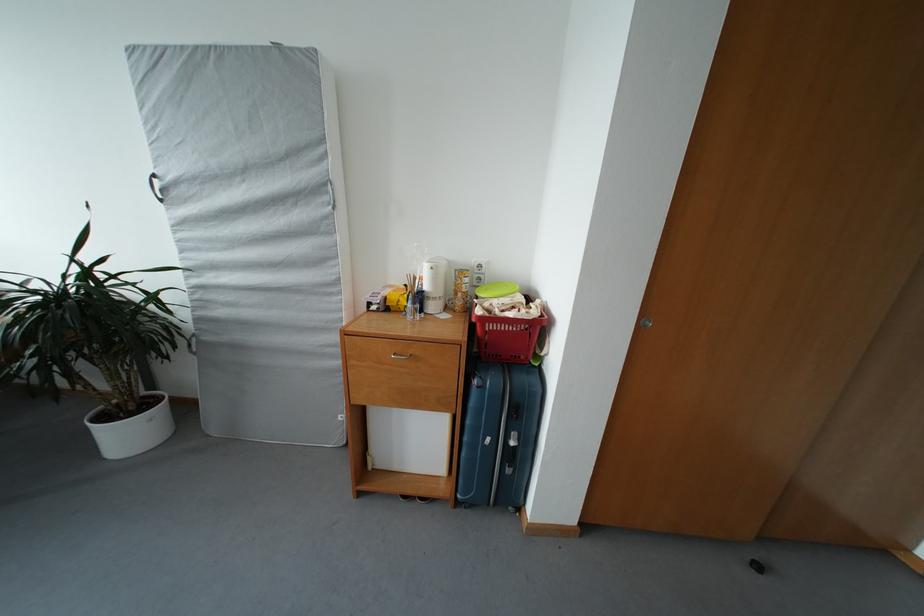
I want to click on silver drawer handle, so click(399, 355).